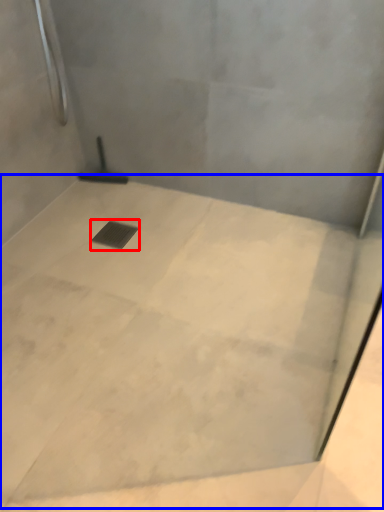
Question: Among these objects, which one is nearest to the camera, drain (highlighted by a red box) or concrete (highlighted by a blue box)?

Choices:
 (A) drain
 (B) concrete

Answer: (B)